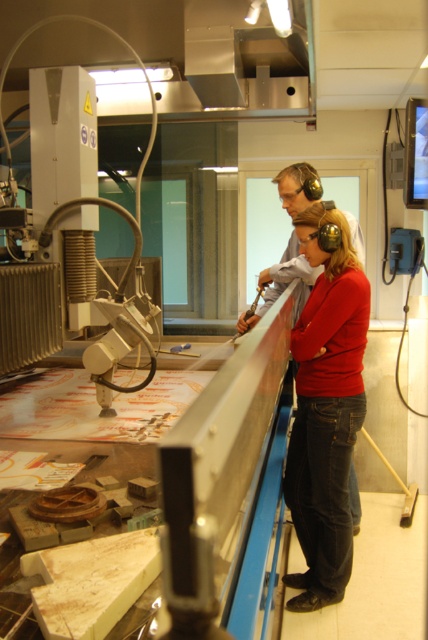
You are an engineer in the workshop and need to place a new tool that requires 15 cm of vertical space. Can the space between the matte red sweater at center and the matte black headphones at upper center accommodate it?

The matte red sweater at center is taller than the matte black headphones at upper center. The vertical space between them might be sufficient for the 15 cm requirement, but since the exact distance isn

You are an engineer in the workshop and need to locate your tools. You remember placing your matte red sweater at center and matte black headphones at upper center. Which item is closer to the left edge of the workbench?

The matte red sweater at center is positioned on the left side of the matte black headphones at upper center, so it is closer to the left edge of the workbench.